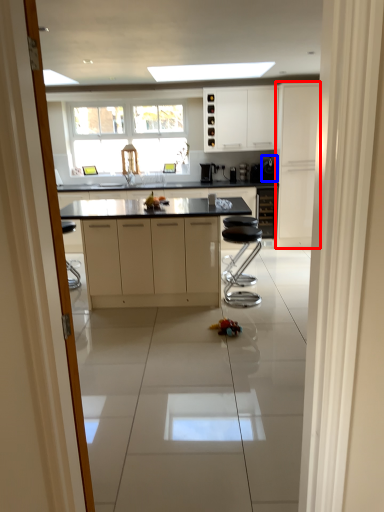
Question: Among these objects, which one is nearest to the camera, cabinetry (highlighted by a red box) or appliance (highlighted by a blue box)?

Choices:
 (A) cabinetry
 (B) appliance

Answer: (A)